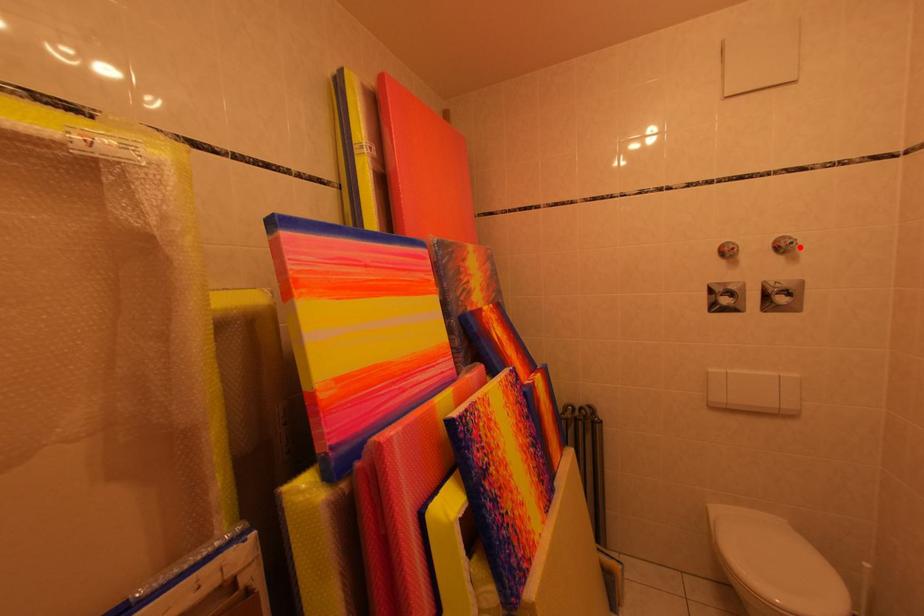
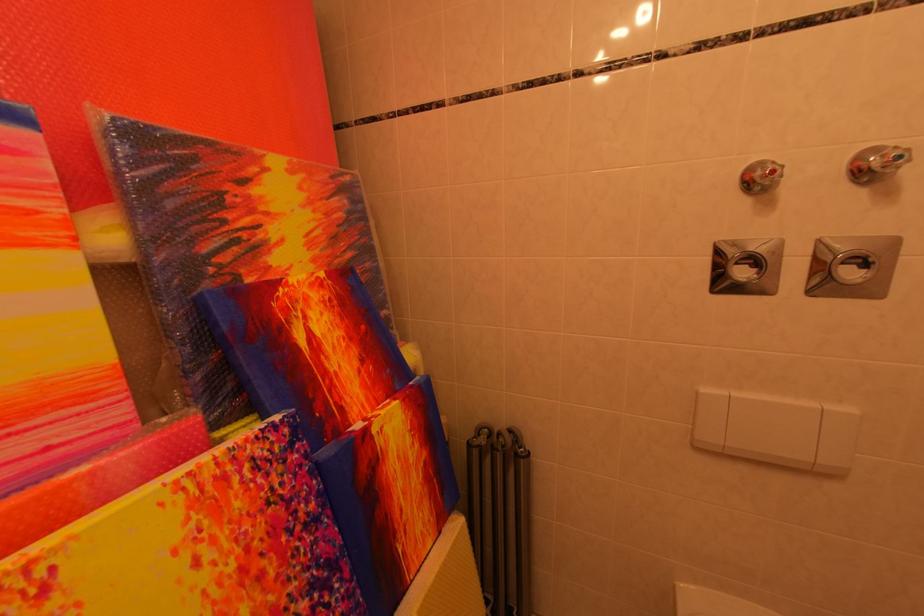
Locate, in the second image, the point that corresponds to the highlighted location in the first image.

(907, 161)